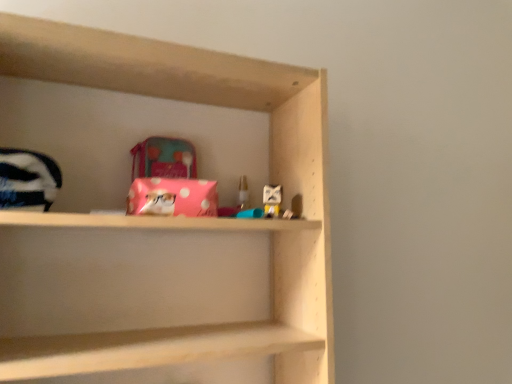
Question: Is pink polka dot plush at upper center, the 2th toy when ordered from back to front, thinner than translucent plastic candle at center, which ranks as the 2th toy in front-to-back order?

Choices:
 (A) yes
 (B) no

Answer: (A)

Question: Is pink polka dot plush at upper center, the 2th toy when ordered from back to front, further to camera compared to translucent plastic candle at center, which ranks as the 2th toy in front-to-back order?

Choices:
 (A) no
 (B) yes

Answer: (A)

Question: From a real-world perspective, is pink polka dot plush at upper center, the second toy positioned from the left, located higher than translucent plastic candle at center, positioned as the first toy in back-to-front order?

Choices:
 (A) no
 (B) yes

Answer: (A)

Question: Are pink polka dot plush at upper center, the first toy viewed from the right, and translucent plastic candle at center, which ranks as the 2th toy in front-to-back order, far apart?

Choices:
 (A) no
 (B) yes

Answer: (A)

Question: Does pink polka dot plush at upper center, the 2th toy when ordered from back to front, have a greater width compared to translucent plastic candle at center, positioned as the first toy in back-to-front order?

Choices:
 (A) yes
 (B) no

Answer: (B)

Question: Is pink polka dot plush at upper center, the second toy positioned from the left, positioned with its back to translucent plastic candle at center, positioned as the first toy in back-to-front order?

Choices:
 (A) yes
 (B) no

Answer: (B)

Question: Is pink polka dot fabric at center at the right side of translucent plastic candle at center, which ranks as the 2th toy in front-to-back order?

Choices:
 (A) yes
 (B) no

Answer: (B)

Question: Does pink polka dot fabric at center turn towards translucent plastic candle at center, placed as the 2th toy when sorted from right to left?

Choices:
 (A) no
 (B) yes

Answer: (A)

Question: From a real-world perspective, is pink polka dot fabric at center on top of translucent plastic candle at center, which ranks as the 2th toy in front-to-back order?

Choices:
 (A) yes
 (B) no

Answer: (B)

Question: Is pink polka dot fabric at center touching translucent plastic candle at center, placed as the 2th toy when sorted from right to left?

Choices:
 (A) no
 (B) yes

Answer: (A)

Question: Is pink polka dot fabric at center positioned in front of translucent plastic candle at center, which ranks as the 2th toy in front-to-back order?

Choices:
 (A) no
 (B) yes

Answer: (B)

Question: From the image's perspective, would you say pink polka dot fabric at center is shown under translucent plastic candle at center, which appears as the first toy when viewed from the left?

Choices:
 (A) yes
 (B) no

Answer: (A)

Question: Is the position of translucent plastic candle at center, which appears as the first toy when viewed from the left, less distant than that of pink polka dot plush at upper center, the first toy positioned from the front?

Choices:
 (A) no
 (B) yes

Answer: (A)